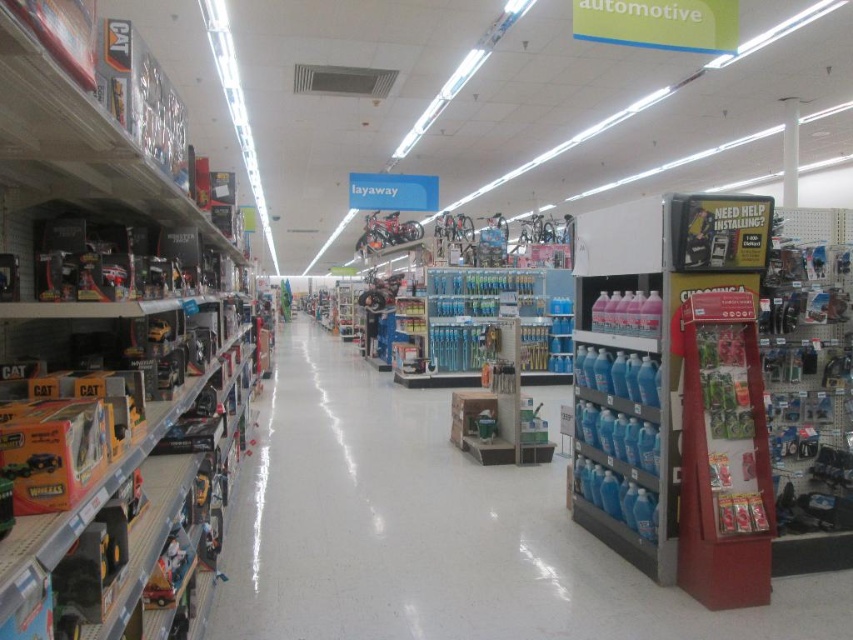
Question: Considering the relative positions of clear plastic bottles at center and metallic silver motorcycle at center in the image provided, where is clear plastic bottles at center located with respect to metallic silver motorcycle at center?

Choices:
 (A) left
 (B) right

Answer: (B)

Question: Which of these objects is positioned farthest from the matte black toy truck at left?

Choices:
 (A) metallic silver motorcycle at center
 (B) metallic silver bicycle at center
 (C) clear plastic bottles at center

Answer: (A)

Question: Can you confirm if clear plastic bottles at center is thinner than metallic silver bicycle at center?

Choices:
 (A) no
 (B) yes

Answer: (A)

Question: Does matte black toy truck at left appear on the right side of metallic silver motorcycle at center?

Choices:
 (A) no
 (B) yes

Answer: (A)

Question: Among these objects, which one is nearest to the camera?

Choices:
 (A) metallic silver motorcycle at center
 (B) clear plastic bottles at center
 (C) matte black toy truck at left
 (D) metallic silver bicycle at center

Answer: (C)

Question: Which object is farther from the camera taking this photo?

Choices:
 (A) metallic silver bicycle at center
 (B) metallic silver motorcycle at center

Answer: (B)